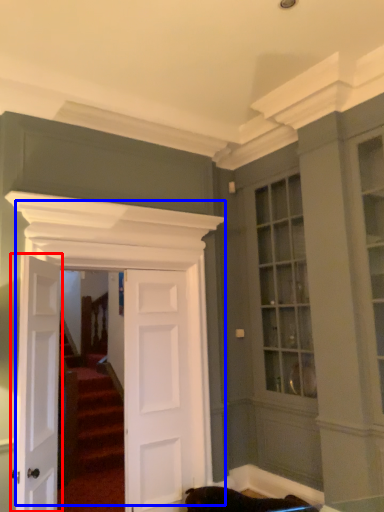
Question: Which point is closer to the camera, door (highlighted by a red box) or door (highlighted by a blue box)?

Choices:
 (A) door
 (B) door

Answer: (A)